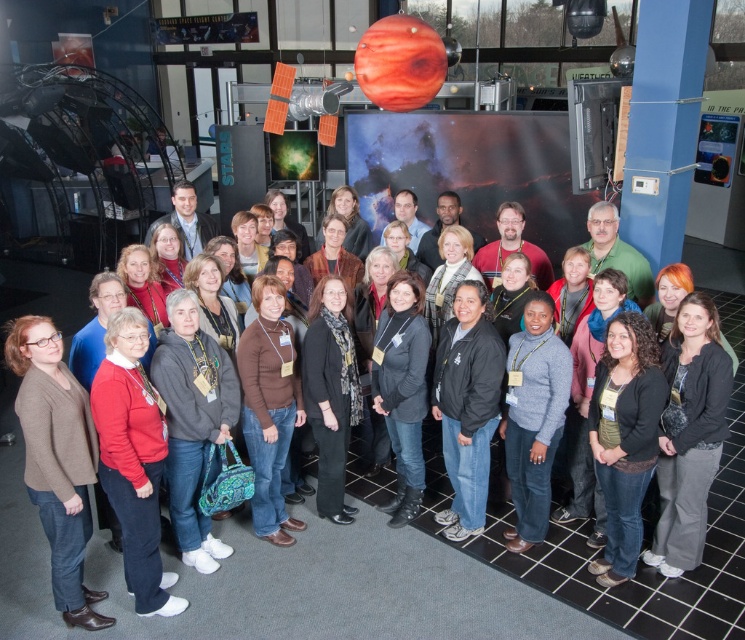
Who is higher up, brown matte sweater at center or black leather jacket at center?

Positioned higher is black leather jacket at center.

Who is more distant from viewer, (294,374) or (387,324)?

The point (387,324) is more distant.

Identify the location of brown matte sweater at center. The width and height of the screenshot is (745, 640). (269, 406).

Is point (69, 586) positioned behind point (402, 332)?

No, (69, 586) is in front of (402, 332).

Does brown sweater at lower left appear on the left side of black leather jacket at center?

Correct, you'll find brown sweater at lower left to the left of black leather jacket at center.

Find the location of a particular element. Image resolution: width=745 pixels, height=640 pixels. brown sweater at lower left is located at coordinates (57, 460).

You are a GUI agent. You are given a task and a screenshot of the screen. Output one action in this format:
    pyautogui.click(x=<x>, y=<y>)
    Task: Click on the brown sweater at lower left
    
    Given the screenshot: What is the action you would take?
    pyautogui.click(x=57, y=460)

From the picture: Is brown sweater at lower left below brown matte sweater at center?

Yes.

Is the position of brown sweater at lower left less distant than that of brown matte sweater at center?

A: Yes, it is in front of brown matte sweater at center.

Does point (51, 531) lie in front of point (294, 388)?

That is True.

Where is `brown sweater at lower left`? The width and height of the screenshot is (745, 640). brown sweater at lower left is located at coordinates (57, 460).